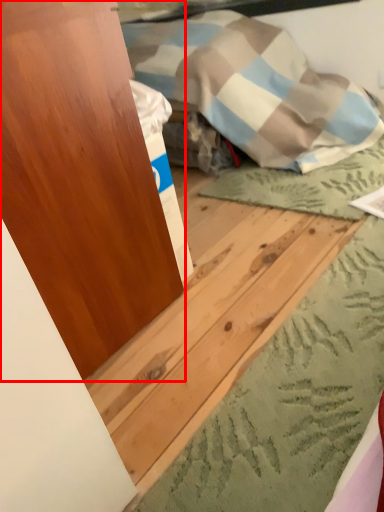
Question: From the image's perspective, what is the correct spatial positioning of dresser (annotated by the red box) in reference to plywood?

Choices:
 (A) above
 (B) below

Answer: (A)